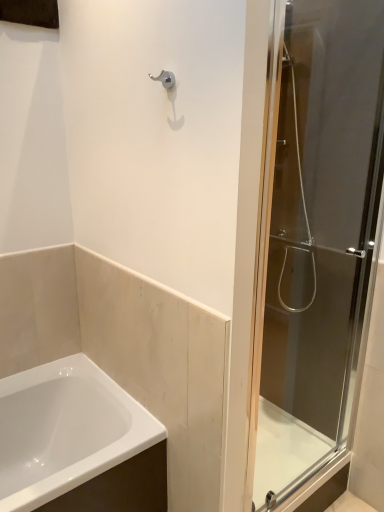
Describe the element at coordinates (319, 237) in the screenshot. I see `transparent glass shower door at right` at that location.

In order to face transparent glass shower door at right, should I rotate leftwards or rightwards?

You should look right and rotate roughly 16.613 degrees.

At what (x,y) coordinates should I click in order to perform the action: click on transparent glass shower door at right. Please return your answer as a coordinate pair (x, y). Looking at the image, I should click on (319, 237).

Find the location of a particular element. white glossy bathtub at lower left is located at coordinates (77, 442).

Describe the element at coordinates (77, 442) in the screenshot. I see `white glossy bathtub at lower left` at that location.

Identify the location of transparent glass shower door at right. (319, 237).

Which object is positioned more to the left, transparent glass shower door at right or white glossy bathtub at lower left?

white glossy bathtub at lower left is more to the left.

Is transparent glass shower door at right in front of or behind white glossy bathtub at lower left in the image?

Clearly, transparent glass shower door at right is in front of white glossy bathtub at lower left.

Which is closer, (333, 178) or (52, 377)?

The point (333, 178) is more forward.

From the image's perspective, is transparent glass shower door at right located above white glossy bathtub at lower left?

Correct, transparent glass shower door at right appears higher than white glossy bathtub at lower left in the image.

From a real-world perspective, who is located higher, transparent glass shower door at right or white glossy bathtub at lower left?

transparent glass shower door at right is physically above.

Does transparent glass shower door at right have a greater width compared to white glossy bathtub at lower left?

In fact, transparent glass shower door at right might be narrower than white glossy bathtub at lower left.

In the scene shown: Considering the relative sizes of transparent glass shower door at right and white glossy bathtub at lower left in the image provided, is transparent glass shower door at right taller than white glossy bathtub at lower left?

Yes.

Who is bigger, transparent glass shower door at right or white glossy bathtub at lower left?

white glossy bathtub at lower left.

Would you say transparent glass shower door at right is inside or outside white glossy bathtub at lower left?

transparent glass shower door at right is outside white glossy bathtub at lower left.

Is transparent glass shower door at right in contact with white glossy bathtub at lower left?

No.

Is white glossy bathtub at lower left at the back of transparent glass shower door at right?

No, transparent glass shower door at right is not facing away from white glossy bathtub at lower left.

Based on the photo, can you tell me how much transparent glass shower door at right and white glossy bathtub at lower left differ in facing direction?

There is a 0.000867-degree angle between the facing directions of transparent glass shower door at right and white glossy bathtub at lower left.

The width and height of the screenshot is (384, 512). I want to click on bathtub that is under the transparent glass shower door at right (from a real-world perspective), so click(x=77, y=442).

Is white glossy bathtub at lower left to the right of transparent glass shower door at right from the viewer's perspective?

No.

Is the position of white glossy bathtub at lower left more distant than that of transparent glass shower door at right?

Yes, white glossy bathtub at lower left is further from the camera.

Between point (154, 434) and point (303, 113), which one is positioned behind?

The point (303, 113) is farther from the camera.

From the image's perspective, is white glossy bathtub at lower left positioned above or below transparent glass shower door at right?

white glossy bathtub at lower left is situated lower than transparent glass shower door at right in the image.

From a real-world perspective, is white glossy bathtub at lower left positioned over transparent glass shower door at right based on gravity?

Incorrect, from a real-world perspective, white glossy bathtub at lower left is lower than transparent glass shower door at right.

Which of these two, white glossy bathtub at lower left or transparent glass shower door at right, is thinner?

Thinner between the two is transparent glass shower door at right.

Considering the sizes of objects white glossy bathtub at lower left and transparent glass shower door at right in the image provided, who is shorter, white glossy bathtub at lower left or transparent glass shower door at right?

white glossy bathtub at lower left.

Considering the relative sizes of white glossy bathtub at lower left and transparent glass shower door at right in the image provided, is white glossy bathtub at lower left smaller than transparent glass shower door at right?

Incorrect, white glossy bathtub at lower left is not smaller in size than transparent glass shower door at right.

Is transparent glass shower door at right located within white glossy bathtub at lower left?

No.

Based on the photo, is white glossy bathtub at lower left beside transparent glass shower door at right?

They are not placed beside each other.

Could you tell me if white glossy bathtub at lower left is turned towards transparent glass shower door at right?

No, white glossy bathtub at lower left does not turn towards transparent glass shower door at right.

How many degrees apart are the facing directions of white glossy bathtub at lower left and transparent glass shower door at right?

0.000867 degrees.

Measure the distance between white glossy bathtub at lower left and transparent glass shower door at right.

86.87 centimeters.

The width and height of the screenshot is (384, 512). I want to click on door in front of the white glossy bathtub at lower left, so click(x=319, y=237).

Find the location of a particular element. This screenshot has height=512, width=384. door above the white glossy bathtub at lower left (from a real-world perspective) is located at coordinates (319, 237).

The width and height of the screenshot is (384, 512). Find the location of `bathtub behind the transparent glass shower door at right`. bathtub behind the transparent glass shower door at right is located at coordinates (77, 442).